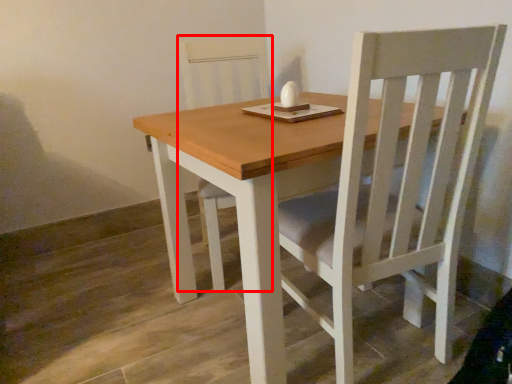
Question: Observing the image, what is the correct spatial positioning of chair (annotated by the red box) in reference to round table?

Choices:
 (A) left
 (B) right

Answer: (A)